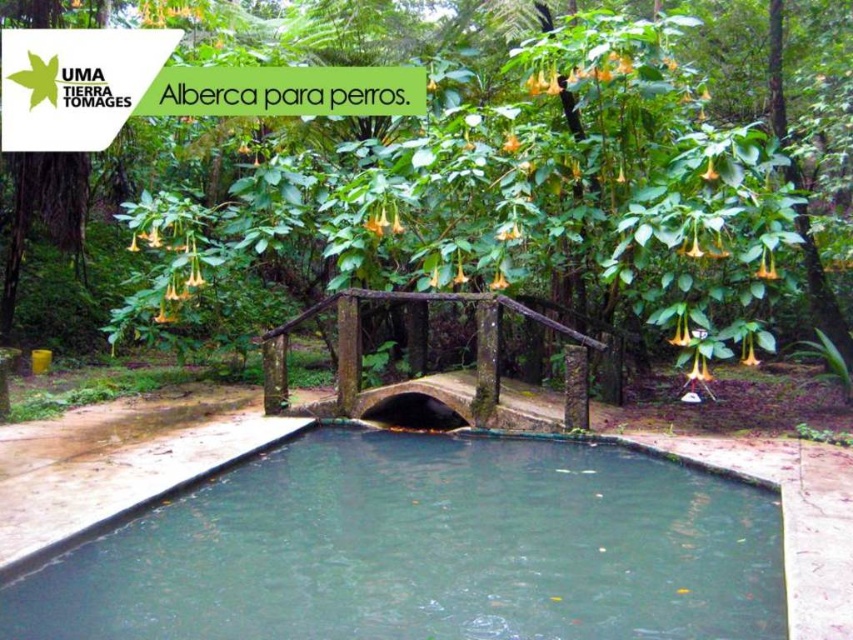
Is clear water at center positioned before green leafy tree at center?

Yes, it is in front of green leafy tree at center.

Locate an element on the screen. The width and height of the screenshot is (853, 640). clear water at center is located at coordinates (426, 548).